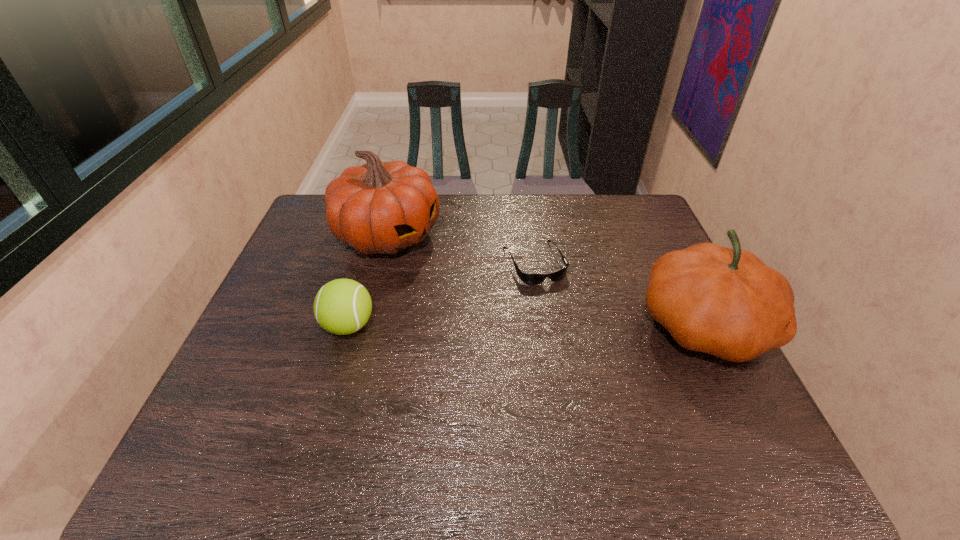
You are a GUI agent. You are given a task and a screenshot of the screen. Output one action in this format:
    pyautogui.click(x=<x>, y=<y>)
    Task: Click on the free space that is in between the nearer pumpkin and the farther pumpkin
    This screenshot has width=960, height=540.
    Given the screenshot: What is the action you would take?
    pyautogui.click(x=546, y=280)

This screenshot has width=960, height=540. In order to click on vacant area between the shortest object and the nearer pumpkin in this screenshot , I will do `click(619, 294)`.

Where is `blank region between the farther pumpkin and the sunglasses`? blank region between the farther pumpkin and the sunglasses is located at coordinates (461, 249).

Locate which object is the third closest to the sunglasses. Please provide its 2D coordinates. Your answer should be formatted as a tuple, i.e. [(x, y)], where the tuple contains the x and y coordinates of a point satisfying the conditions above.

[(343, 306)]

Where is `object identified as the closest to the farther pumpkin`? This screenshot has width=960, height=540. object identified as the closest to the farther pumpkin is located at coordinates (343, 306).

You are a GUI agent. You are given a task and a screenshot of the screen. Output one action in this format:
    pyautogui.click(x=<x>, y=<y>)
    Task: Click on the vacant area that satisfies the following two spatial constraints: 1. on the front side of the right pumpkin; 2. on the front face of the farther pumpkin
    Image resolution: width=960 pixels, height=540 pixels.
    Given the screenshot: What is the action you would take?
    point(365,325)

Identify the location of vacant point that satisfies the following two spatial constraints: 1. on the front side of the shortest object; 2. on the front face of the right pumpkin. This screenshot has width=960, height=540. [543, 325].

This screenshot has height=540, width=960. What are the coordinates of `free region that satisfies the following two spatial constraints: 1. on the back side of the third tallest object; 2. on the left side of the left pumpkin` in the screenshot? It's located at point(375,235).

Find the location of a particular element. free spot that satisfies the following two spatial constraints: 1. on the front side of the left pumpkin; 2. on the front face of the nearer pumpkin is located at coordinates (365, 325).

Image resolution: width=960 pixels, height=540 pixels. In order to click on free space that satisfies the following two spatial constraints: 1. on the front side of the farther pumpkin; 2. on the front face of the nearer pumpkin in this screenshot , I will do `click(365, 325)`.